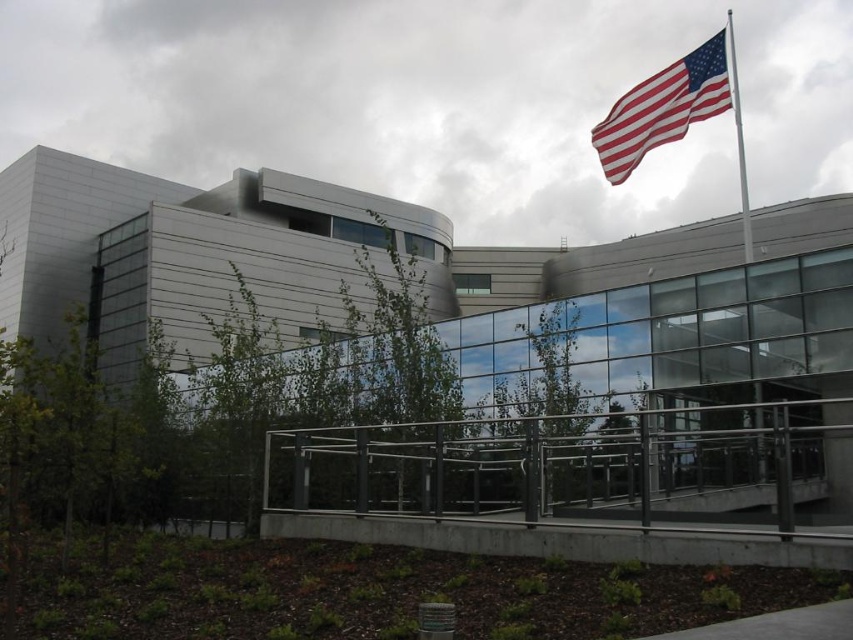
Does red-white striped fabric flag at upper right lie in front of white metallic flag pole at upper right?

That is True.

Can you confirm if red-white striped fabric flag at upper right is positioned below white metallic flag pole at upper right?

No.

Is point (683, 109) more distant than point (730, 29)?

No.

This screenshot has height=640, width=853. In order to click on red-white striped fabric flag at upper right in this screenshot , I will do `click(668, 106)`.